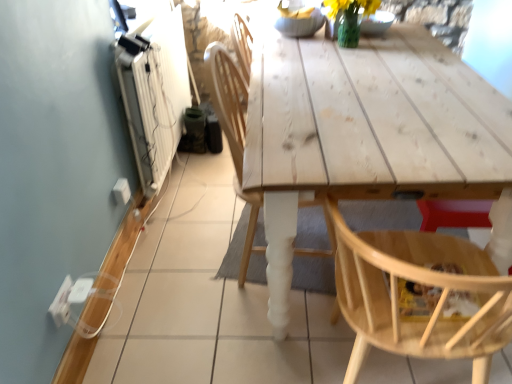
You are a GUI agent. You are given a task and a screenshot of the screen. Output one action in this format:
    pyautogui.click(x=<x>, y=<y>)
    Task: Click on the free region on the left part of wooden chair at center, the 2th chair when ordered from right to left
    This screenshot has width=512, height=384.
    Given the screenshot: What is the action you would take?
    pyautogui.click(x=186, y=258)